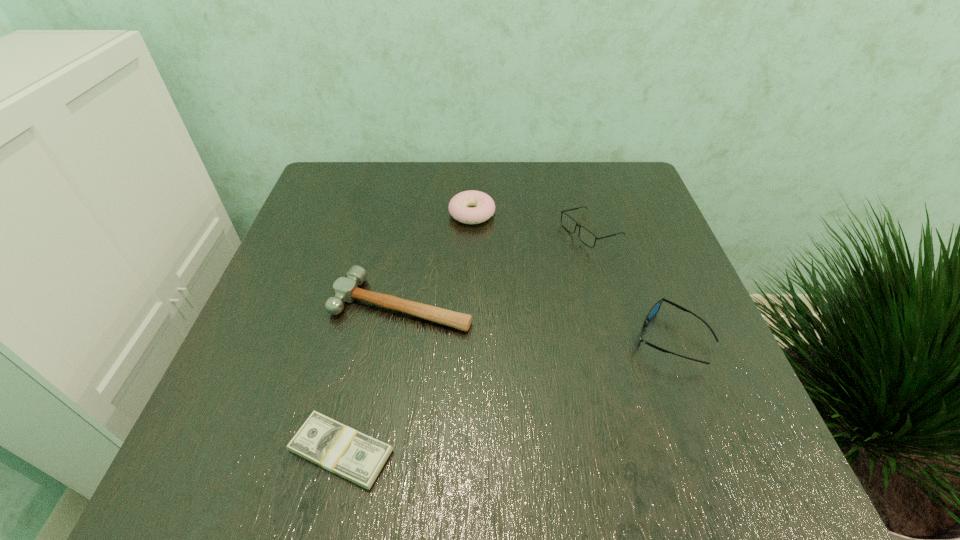
I want to click on the tallest object, so click(x=586, y=236).

The width and height of the screenshot is (960, 540). I want to click on doughnut, so click(459, 206).

Find the location of a particular element. This screenshot has height=540, width=960. hammer is located at coordinates (345, 289).

Identify the location of sunglasses. (654, 310).

Image resolution: width=960 pixels, height=540 pixels. Identify the location of the shortest object. (342, 450).

Identify the location of dollar. The width and height of the screenshot is (960, 540). (342, 450).

Find the location of a particular element. Image resolution: width=960 pixels, height=540 pixels. free space located with the lenses facing outward on the tallest object is located at coordinates (401, 233).

Locate an element on the screen. The width and height of the screenshot is (960, 540). free point located with the lenses facing outward on the tallest object is located at coordinates (488, 233).

This screenshot has height=540, width=960. I want to click on vacant space situated 0.220m with the lenses facing outward on the tallest object, so pos(467,233).

Locate an element on the screen. The height and width of the screenshot is (540, 960). vacant space located on the front of the doughnut is located at coordinates (471, 254).